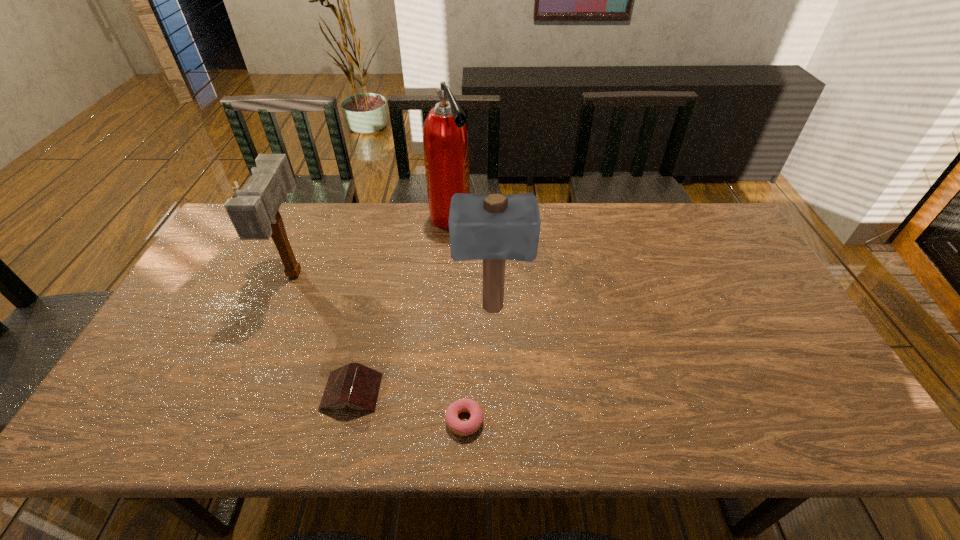
At what (x,y) coordinates should I click in order to perform the action: click on the farthest object. Please return your answer as a coordinate pair (x, y). This screenshot has width=960, height=540. Looking at the image, I should click on (445, 139).

This screenshot has width=960, height=540. Find the location of `fire extinguisher`. fire extinguisher is located at coordinates (445, 139).

Locate an element on the screen. Image resolution: width=960 pixels, height=540 pixels. the right mallet is located at coordinates (493, 228).

Where is `the left mallet`? This screenshot has width=960, height=540. the left mallet is located at coordinates (254, 214).

The image size is (960, 540). Find the location of `the fourth object from right to left`. the fourth object from right to left is located at coordinates (354, 384).

Where is `the second shortest object`? the second shortest object is located at coordinates (354, 384).

Locate an element on the screen. The width and height of the screenshot is (960, 540). the shortest object is located at coordinates (463, 428).

Identify the location of vacant space located on the front of the tallest object. This screenshot has height=540, width=960. (444, 289).

I want to click on vacant point located 0.350m on the back of the right mallet, so click(490, 219).

The width and height of the screenshot is (960, 540). What are the coordinates of `vacant region located 0.140m on the front of the leftmost object` in the screenshot? It's located at (265, 343).